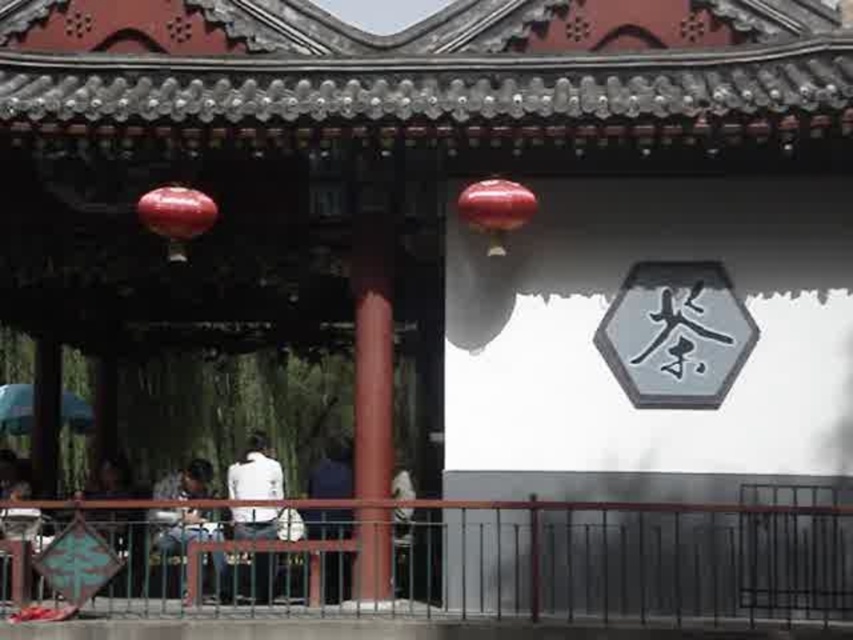
You are standing at the entrance of the traditional Chinese pavilion and want to find the metallic black railing at lower center. Based on the coordinates provided, which direction should you look to locate it?

The metallic black railing at lower center is located at coordinates point [477,561], which corresponds to the lower center area of the image. You should look downward from the entrance towards the lower central part of the structure to find it.

You are a visitor standing in front of the traditional Chinese pavilion. You notice a smooth red pillar at center and a dark blue shirt at center. Which object is located to the right of the other?

The smooth red pillar at center is positioned on the right side of dark blue shirt at center.

You are a visitor standing at the entrance of the traditional Chinese pavilion. You notice both the metallic black railing at lower center and the dark blue jeans at lower center. Which object is taller?

The metallic black railing at lower center is taller than the dark blue jeans at lower center.